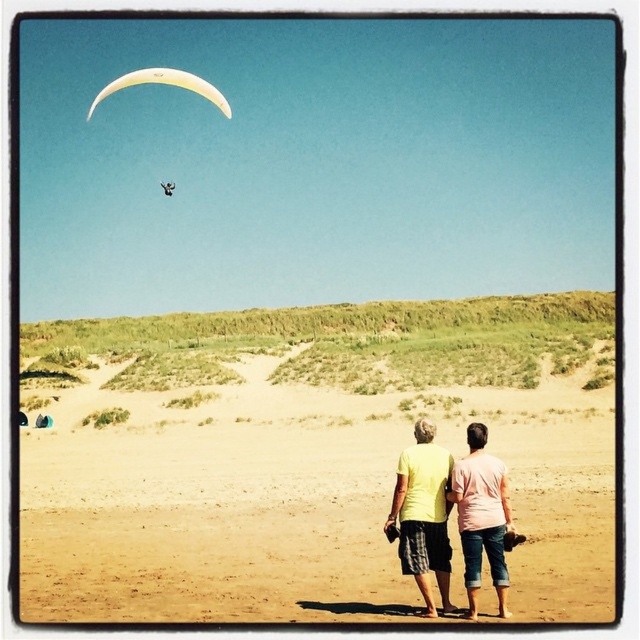
You are planning to set up a small tent for a beach picnic. Given the presence of the sandy yellow beach at center and the pink cotton shirt at lower right, which location would be more suitable for setting up the tent and why?

The sandy yellow beach at center is more suitable for setting up the tent because it has a larger size compared to the pink cotton shirt at lower right, providing enough space for the tent and ensuring stability on the sand.

You are a photographer trying to capture both the yellow matte shirt at center and the yellow fabric parachute at upper center in the same frame. Based on their positions, which object should you focus on first to ensure both are in the shot?

The yellow matte shirt at center is located below the yellow fabric parachute at upper center, so you should focus on the yellow fabric parachute at upper center first to ensure both objects are within the frame.